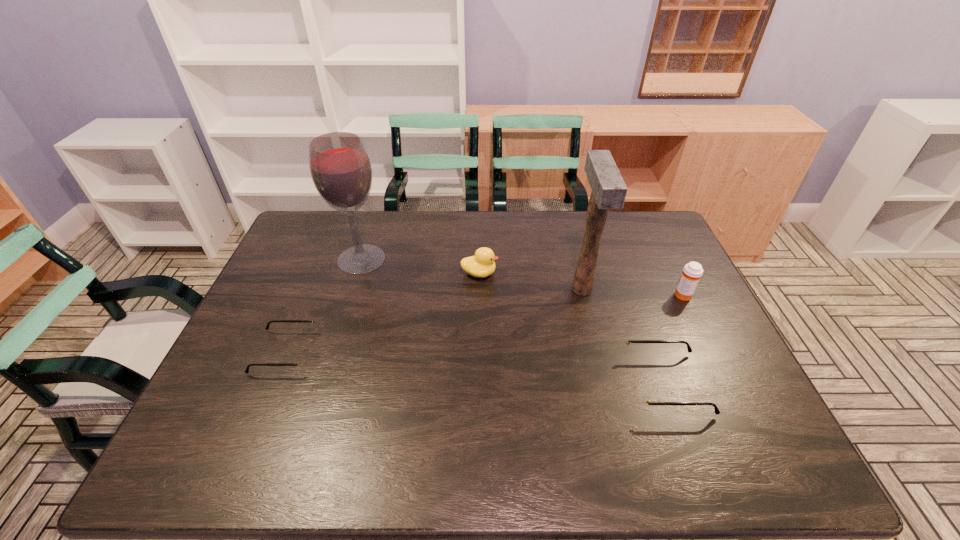
Locate an element on the screen. The height and width of the screenshot is (540, 960). the shortest object is located at coordinates (303, 360).

Locate an element on the screen. Image resolution: width=960 pixels, height=540 pixels. the left spectacles is located at coordinates (303, 360).

You are a GUI agent. You are given a task and a screenshot of the screen. Output one action in this format:
    pyautogui.click(x=<x>, y=<y>)
    Task: Click on the fifth tallest object
    
    Given the screenshot: What is the action you would take?
    pyautogui.click(x=641, y=398)

I want to click on the fifth object from left to right, so click(641, 398).

Where is `the fourth tallest object`? the fourth tallest object is located at coordinates (482, 264).

At what (x,y) coordinates should I click in order to perform the action: click on the fourth object from right to left. Please return your answer as a coordinate pair (x, y). Image resolution: width=960 pixels, height=540 pixels. Looking at the image, I should click on (482, 264).

Where is `alcohol`? This screenshot has width=960, height=540. alcohol is located at coordinates (341, 171).

The image size is (960, 540). I want to click on the rightmost object, so click(x=692, y=272).

Where is `medicine`? The image size is (960, 540). medicine is located at coordinates (692, 272).

At what (x,y) coordinates should I click in order to perform the action: click on mallet. Please return your answer as a coordinate pair (x, y). Looking at the image, I should click on (609, 190).